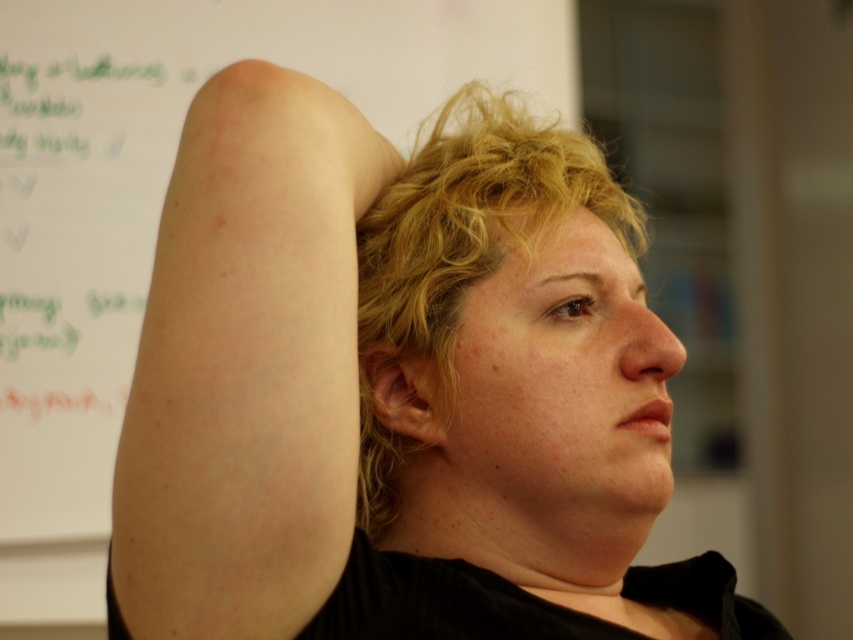
Consider the image. You are a photographer adjusting lighting in a studio. You notice the pale skin arm at upper left and the white paper at upper left in your frame. Which object would appear narrower in the photo?

The pale skin arm at upper left has a lesser width compared to the white paper at upper left, so it would appear narrower in the photo.